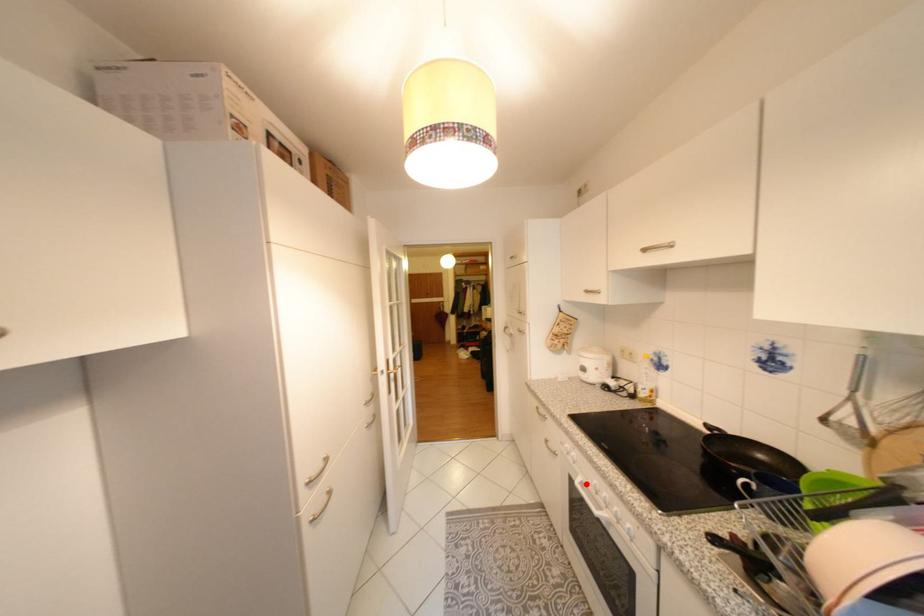
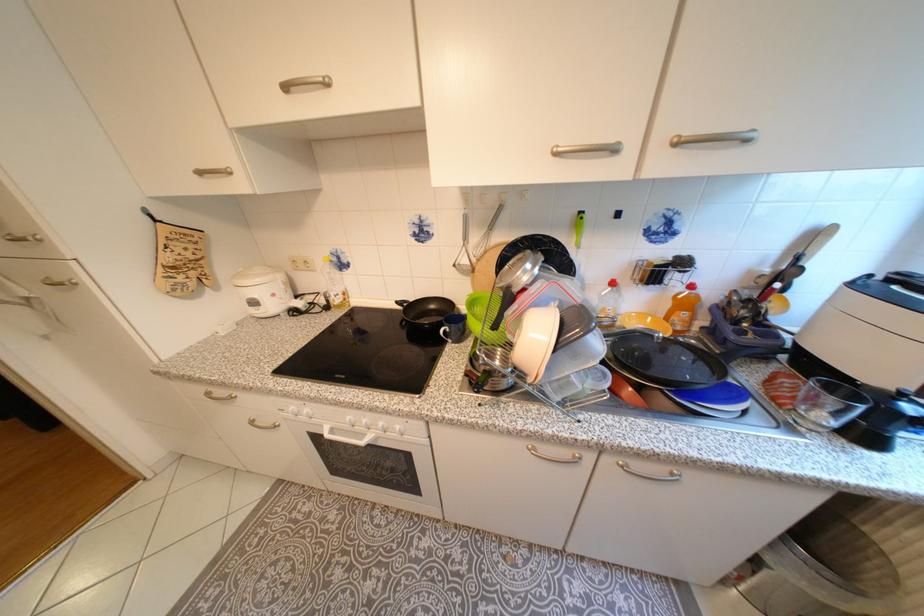
Question: A red point is marked in image1. In image2, is the corresponding 3D point closer to the camera or farther? Reply with the corresponding letter.

Choices:
 (A) The corresponding 3D point is closer.
 (B) The corresponding 3D point is farther.

Answer: (B)